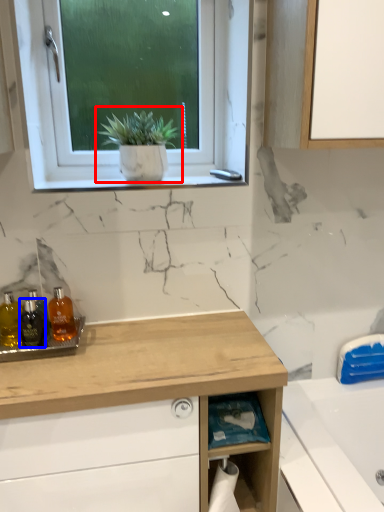
Question: Which object is further to the camera taking this photo, houseplant (highlighted by a red box) or bottle (highlighted by a blue box)?

Choices:
 (A) houseplant
 (B) bottle

Answer: (A)